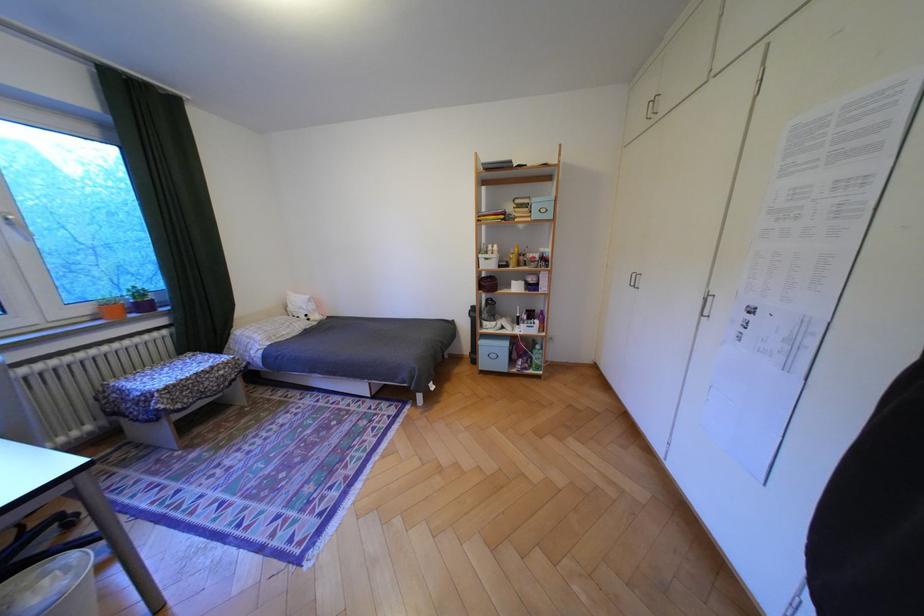
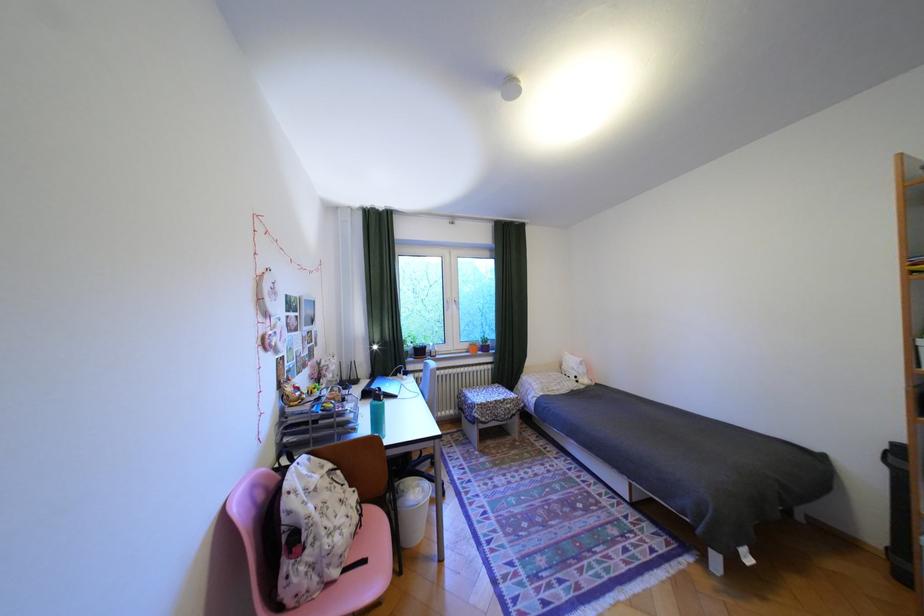
Question: How did the camera likely rotate?

Choices:
 (A) Left
 (B) Right
 (C) Up
 (D) Down

Answer: (A)